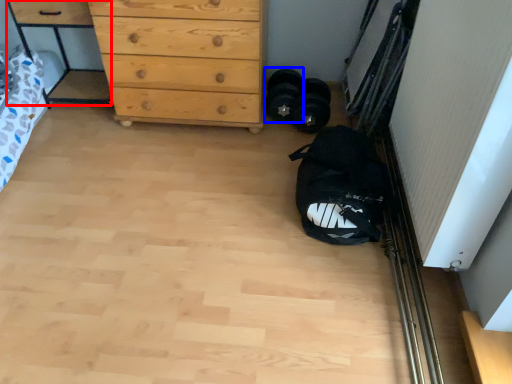
Question: Among these objects, which one is farthest to the camera, cabinetry (highlighted by a red box) or footwear (highlighted by a blue box)?

Choices:
 (A) cabinetry
 (B) footwear

Answer: (B)